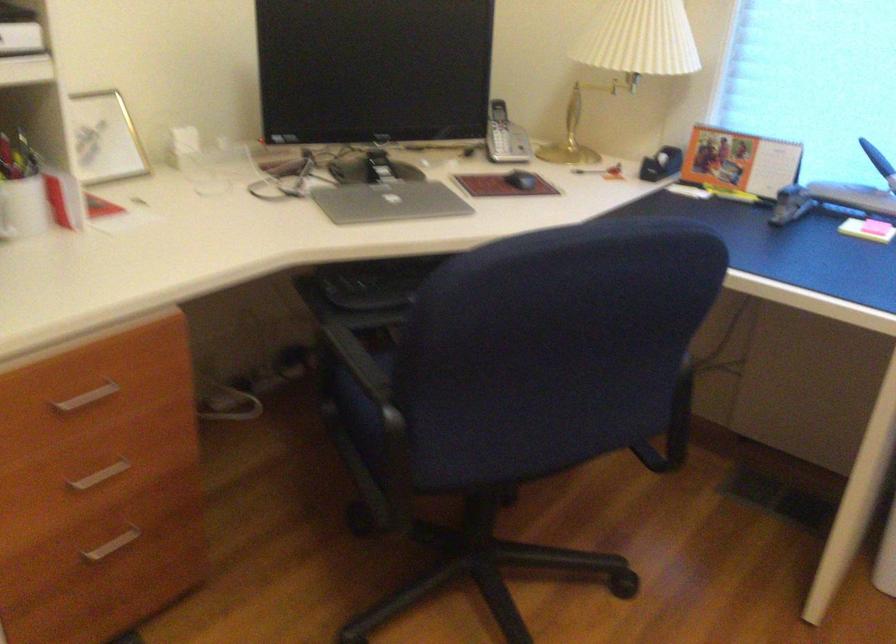
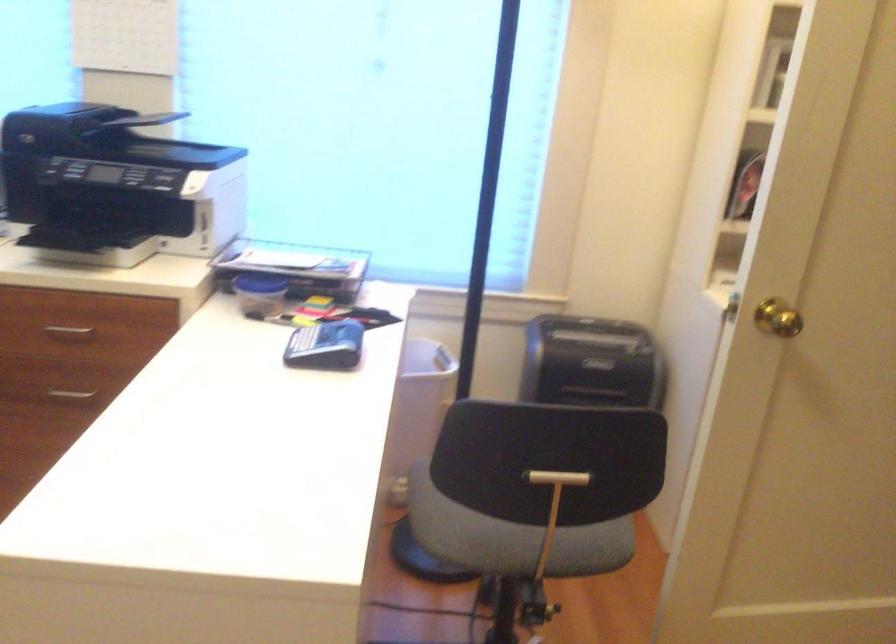
Question: How did the camera likely rotate?

Choices:
 (A) Left
 (B) Right
 (C) Up
 (D) Down

Answer: (B)